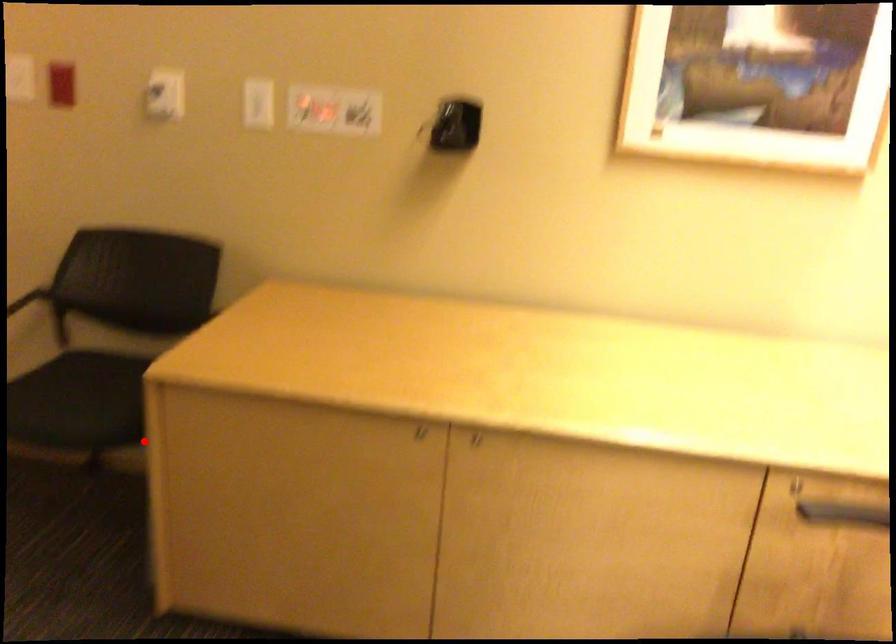
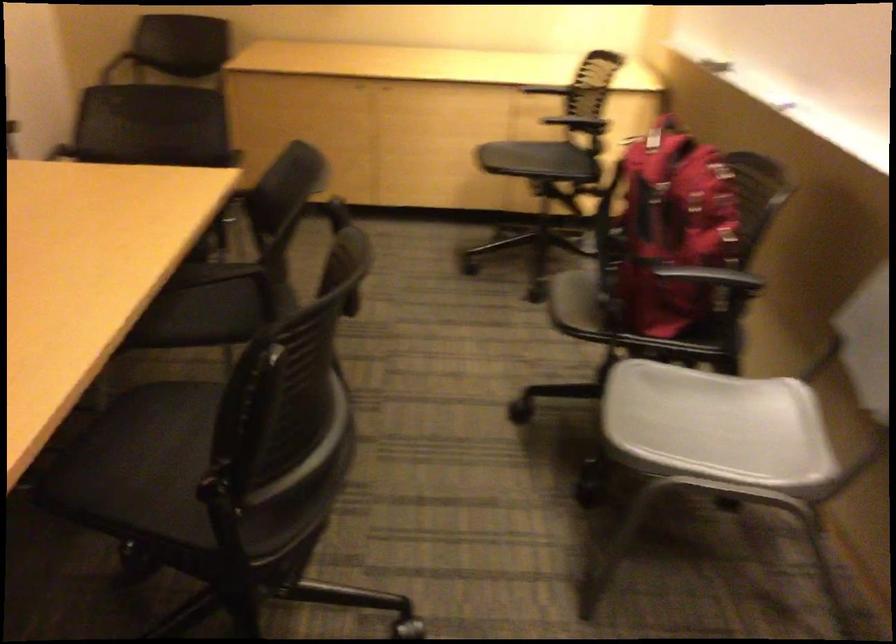
Question: I am providing you with two images of the same scene from different viewpoints. A red point is marked on the first image. Is the red point's position out of view in image 2?

Choices:
 (A) Yes
 (B) No

Answer: (A)